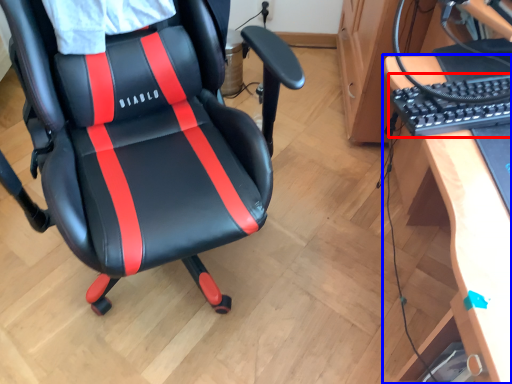
Question: Which of the following is the closest to the observer, computer keyboard (highlighted by a red box) or desk (highlighted by a blue box)?

Choices:
 (A) computer keyboard
 (B) desk

Answer: (B)